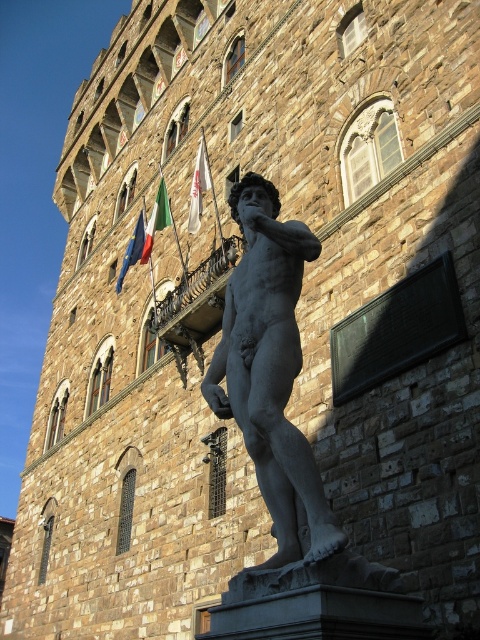
You are a visitor standing in front of the grand stone building. You notice the green fabric flag at upper center and the blue fabric flag at upper left. Which flag is located to the right of the other?

The green fabric flag at upper center is positioned on the right side of the blue fabric flag at upper left.

You are a photographer planning to capture the grand stone building. You notice the matte gray statue at center and the white fabric flag at upper center. Which object should you focus on if you want to include both in a single frame without cropping, considering their widths?

The matte gray statue at center might be wider than the white fabric flag at upper center, so focusing on the statue would ensure both fit in the frame as the statue requires more width.